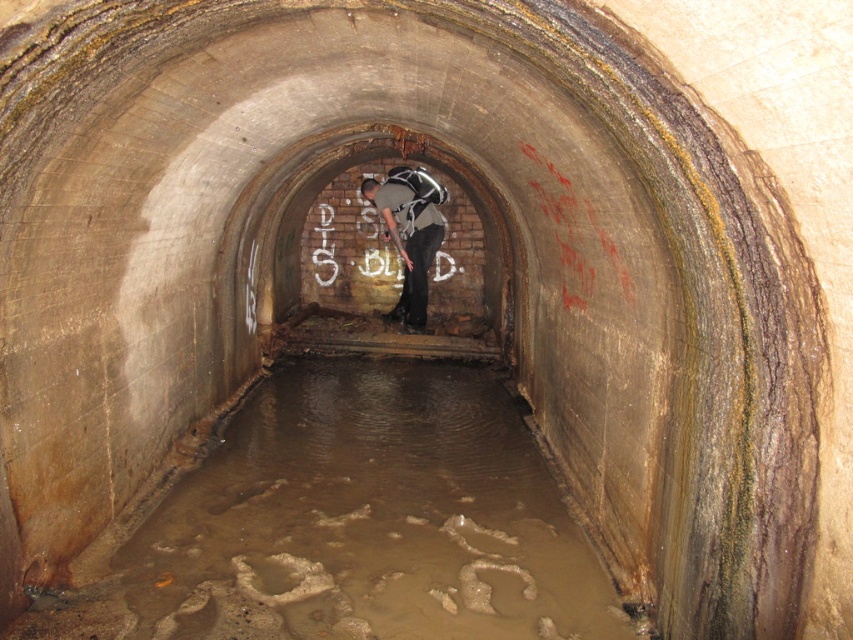
Does muddy concrete flood at center appear on the right side of gray fabric backpack at center?

Incorrect, muddy concrete flood at center is not on the right side of gray fabric backpack at center.

Locate an element on the screen. This screenshot has height=640, width=853. muddy concrete flood at center is located at coordinates (357, 524).

Find the location of a particular element. The image size is (853, 640). muddy concrete flood at center is located at coordinates (357, 524).

Is white chalk graffiti at center wider than gray fabric backpack at center?

Yes, white chalk graffiti at center is wider than gray fabric backpack at center.

Who is higher up, white chalk graffiti at center or gray fabric backpack at center?

white chalk graffiti at center is above.

Measure the distance between point (335,260) and camera.

They are 31.17 feet apart.

The width and height of the screenshot is (853, 640). Find the location of `white chalk graffiti at center`. white chalk graffiti at center is located at coordinates (346, 244).

Is point (312, 444) farther from viewer compared to point (350, 252)?

No.

Is point (500, 396) farther from camera compared to point (318, 211)?

No.

At what (x,y) coordinates should I click in order to perform the action: click on muddy concrete flood at center. Please return your answer as a coordinate pair (x, y). The width and height of the screenshot is (853, 640). Looking at the image, I should click on (357, 524).